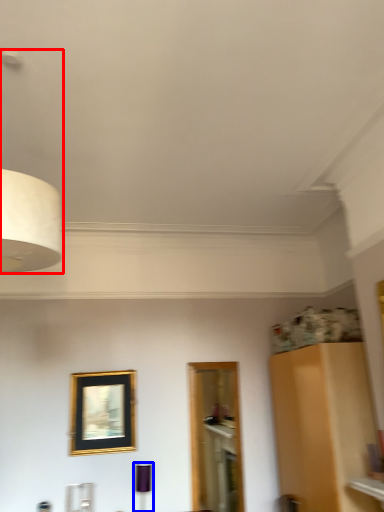
Question: Among these objects, which one is nearest to the camera, lamp (highlighted by a red box) or lamp (highlighted by a blue box)?

Choices:
 (A) lamp
 (B) lamp

Answer: (A)